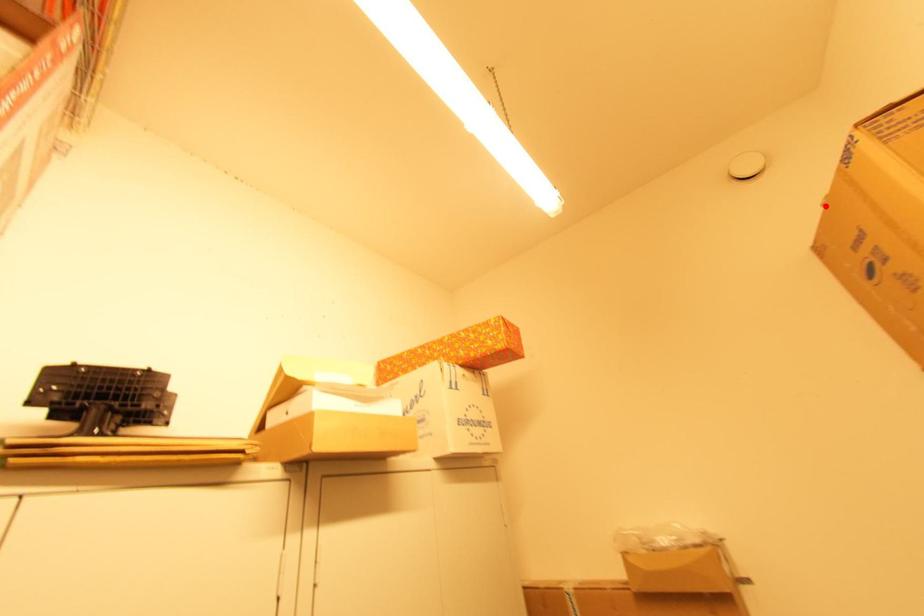
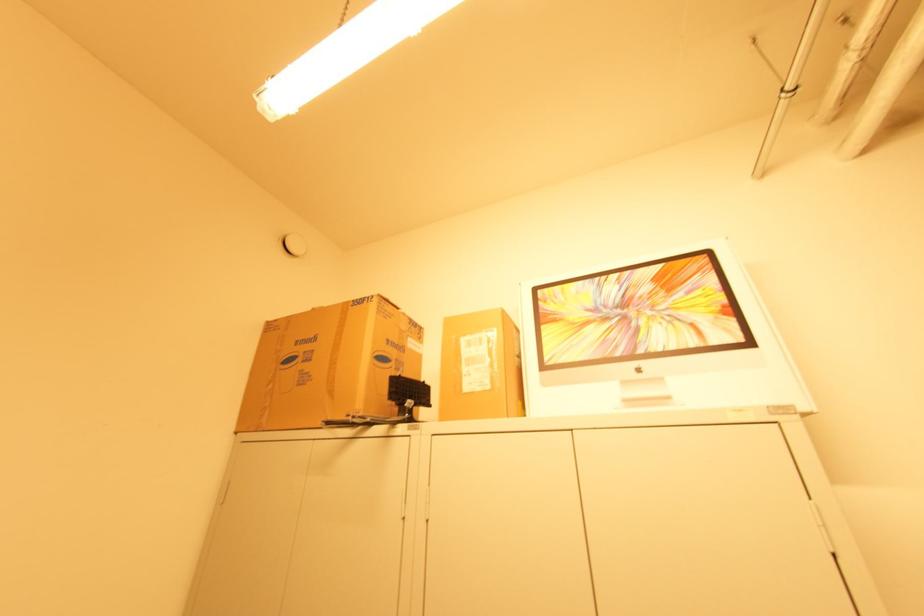
Find the pixel in the second image that matches the highlighted location in the first image.

(315, 309)